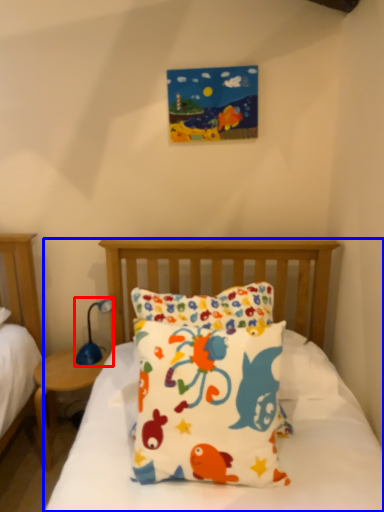
Question: Which point is further to the camera, table lamp (highlighted by a red box) or bed (highlighted by a blue box)?

Choices:
 (A) table lamp
 (B) bed

Answer: (A)